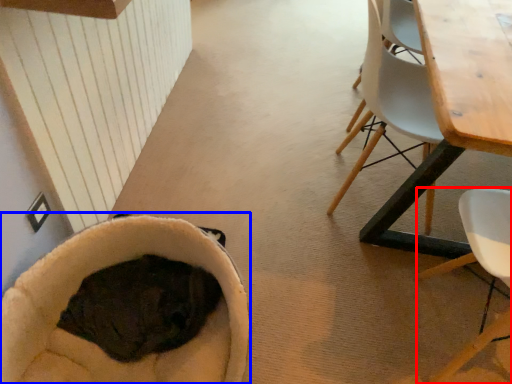
Question: Which object appears closest to the camera in this image, chair (highlighted by a red box) or bean bag chair (highlighted by a blue box)?

Choices:
 (A) chair
 (B) bean bag chair

Answer: (A)